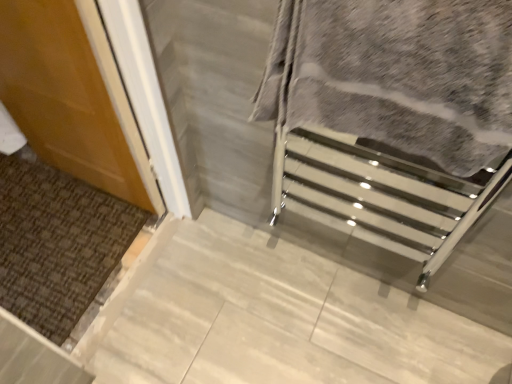
Question: Relative to gray textured towel at center, is matte wood door at left in front or behind?

Choices:
 (A) front
 (B) behind

Answer: (B)

Question: Is matte wood door at left to the left or to the right of gray textured towel at center in the image?

Choices:
 (A) right
 (B) left

Answer: (B)

Question: Considering the positions of point (74, 71) and point (483, 87), is point (74, 71) closer or farther from the camera than point (483, 87)?

Choices:
 (A) farther
 (B) closer

Answer: (A)

Question: Based on their positions, is gray textured towel at center located to the left or right of matte wood door at left?

Choices:
 (A) left
 (B) right

Answer: (B)

Question: From the image's perspective, is gray textured towel at center located above or below matte wood door at left?

Choices:
 (A) above
 (B) below

Answer: (B)

Question: Considering the positions of point (470, 72) and point (100, 132), is point (470, 72) closer or farther from the camera than point (100, 132)?

Choices:
 (A) closer
 (B) farther

Answer: (A)

Question: Considering the positions of gray textured towel at center and matte wood door at left in the image, is gray textured towel at center wider or thinner than matte wood door at left?

Choices:
 (A) thin
 (B) wide

Answer: (B)